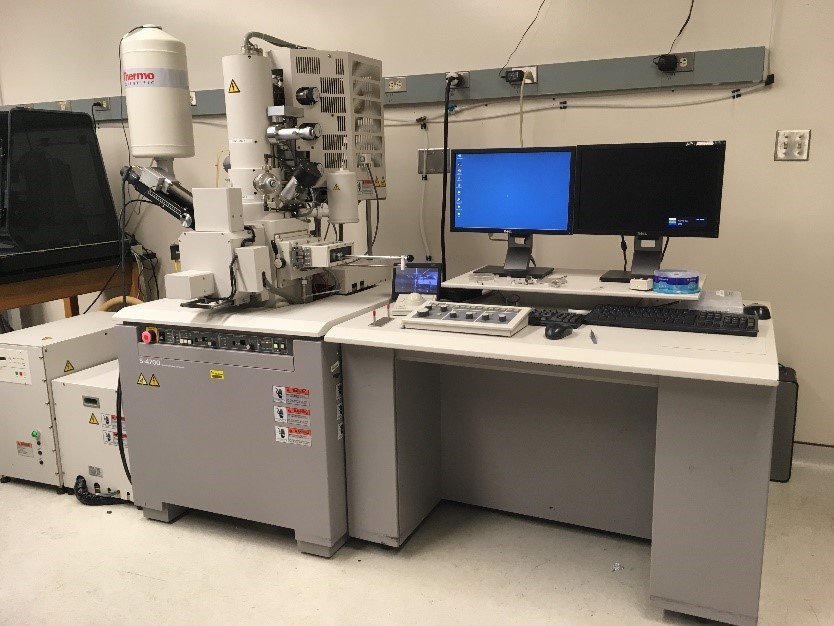
Where is `gray floor`? The image size is (834, 626). gray floor is located at coordinates [168, 565].